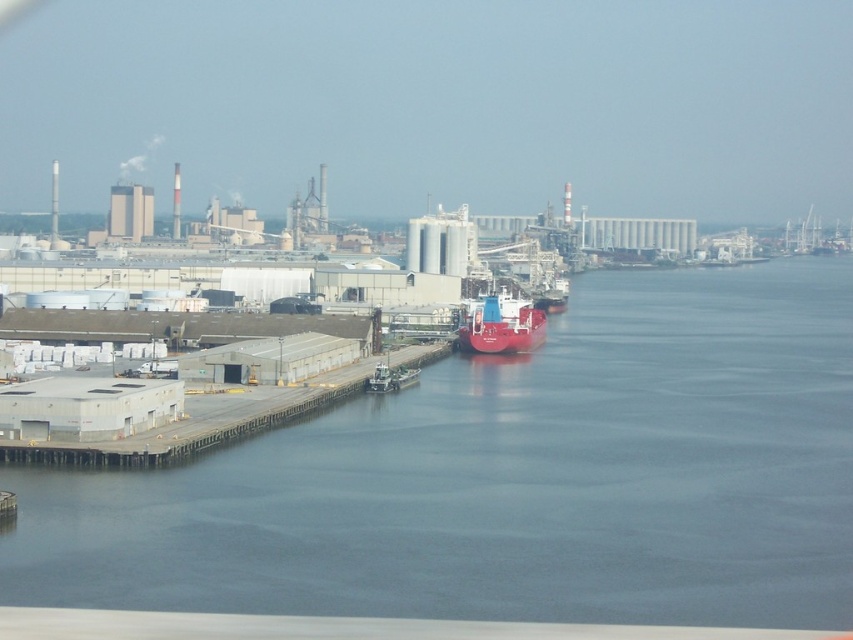
Question: Which point is closer to the camera?

Choices:
 (A) gray concrete dock at lower left
 (B) blue water at center
 (C) red matte ship at center

Answer: (B)

Question: Does blue water at center lie behind gray concrete dock at lower left?

Choices:
 (A) no
 (B) yes

Answer: (A)

Question: Estimate the real-world distances between objects in this image. Which object is closer to the blue water at center?

Choices:
 (A) red matte ship at center
 (B) gray concrete dock at lower left

Answer: (B)

Question: Can you confirm if gray concrete dock at lower left is positioned above red matte ship at center?

Choices:
 (A) no
 (B) yes

Answer: (A)

Question: Can you confirm if gray concrete dock at lower left is wider than red matte ship at center?

Choices:
 (A) no
 (B) yes

Answer: (B)

Question: Based on their relative distances, which object is nearer to the gray concrete dock at lower left?

Choices:
 (A) red matte ship at center
 (B) blue water at center

Answer: (A)